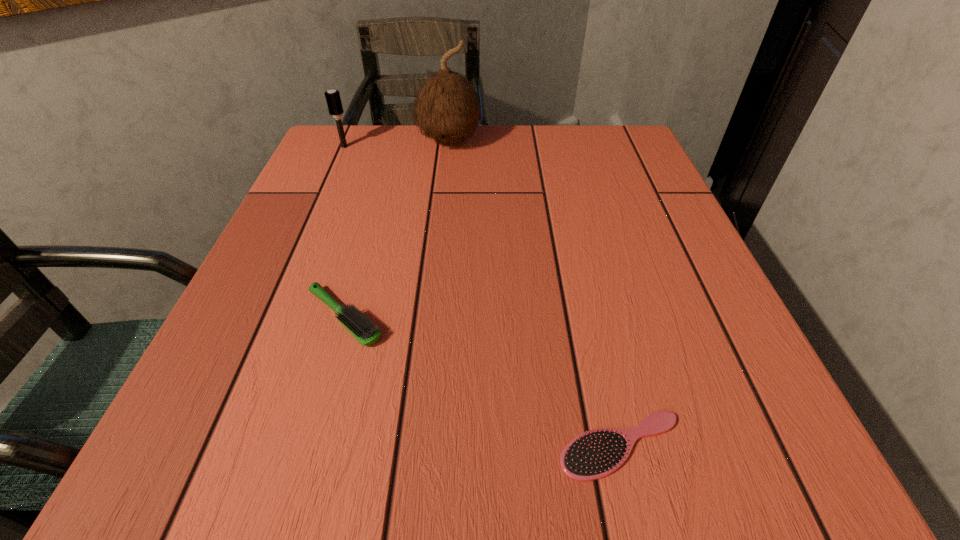
You are a GUI agent. You are given a task and a screenshot of the screen. Output one action in this format:
    pyautogui.click(x=<x>, y=<y>)
    Task: Click on the free region at the far left corner of the desktop
    
    Given the screenshot: What is the action you would take?
    pyautogui.click(x=362, y=177)

At what (x,y) coordinates should I click in order to perform the action: click on blank area at the near left corner. Please return your answer as a coordinate pair (x, y). The width and height of the screenshot is (960, 540). Looking at the image, I should click on (206, 444).

Where is `free space at the far right corner of the desktop`? This screenshot has height=540, width=960. free space at the far right corner of the desktop is located at coordinates (636, 161).

The image size is (960, 540). Identify the location of free space at the near right corner. (784, 425).

Identify the location of free space between the nearest hairbrush and the second shortest hairbrush. (483, 381).

Identify the location of vacant region between the rightmost object and the coconut. (535, 293).

This screenshot has height=540, width=960. I want to click on unoccupied position between the coconut and the nearest hairbrush, so click(535, 293).

I want to click on empty location between the second nearest hairbrush and the third shortest object, so click(x=345, y=232).

Image resolution: width=960 pixels, height=540 pixels. Identify the location of free space between the coconut and the leftmost object. (396, 144).

Identify the location of empty space that is in between the leftmost object and the coconut. (396, 144).